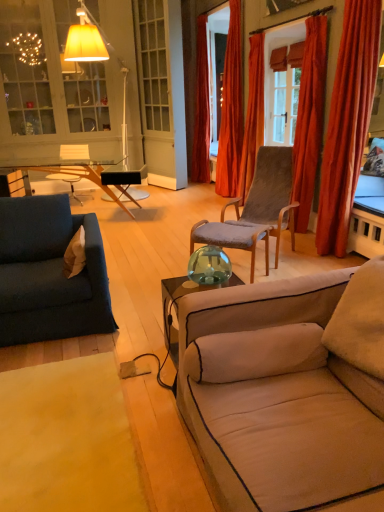
Where is `free space to the left of beige fabric couch at lower right, which is the 1th studio couch from right to left`? The width and height of the screenshot is (384, 512). free space to the left of beige fabric couch at lower right, which is the 1th studio couch from right to left is located at coordinates (118, 428).